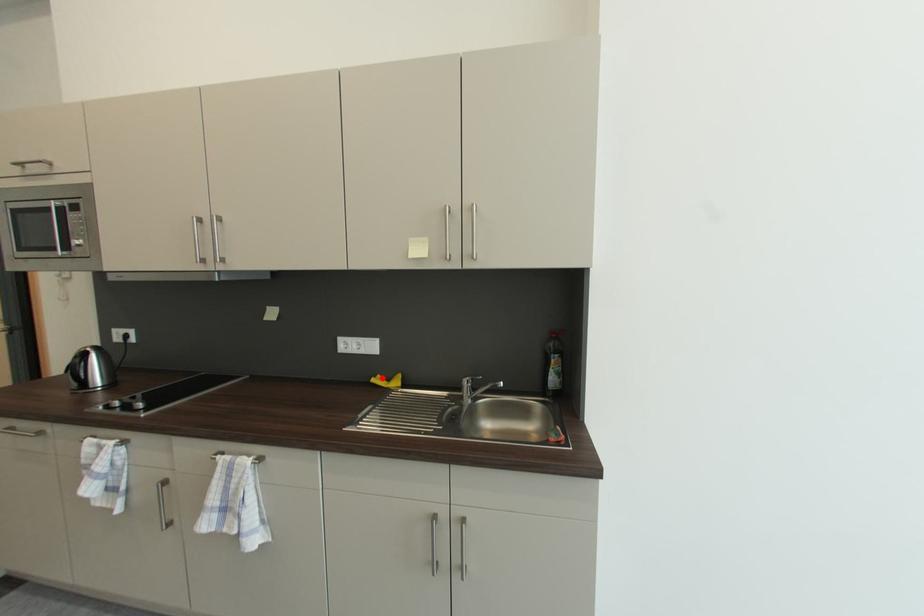
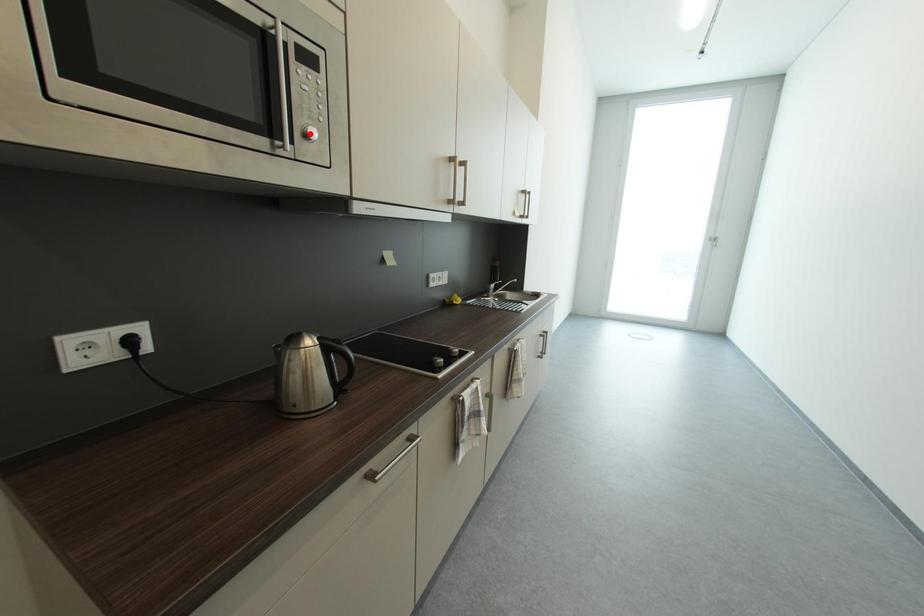
I am providing you with two images of the same scene from different viewpoints. A red point is marked on the first image and another point is marked on the second image. Is the red point in image1 aligned with the point shown in image2?

No